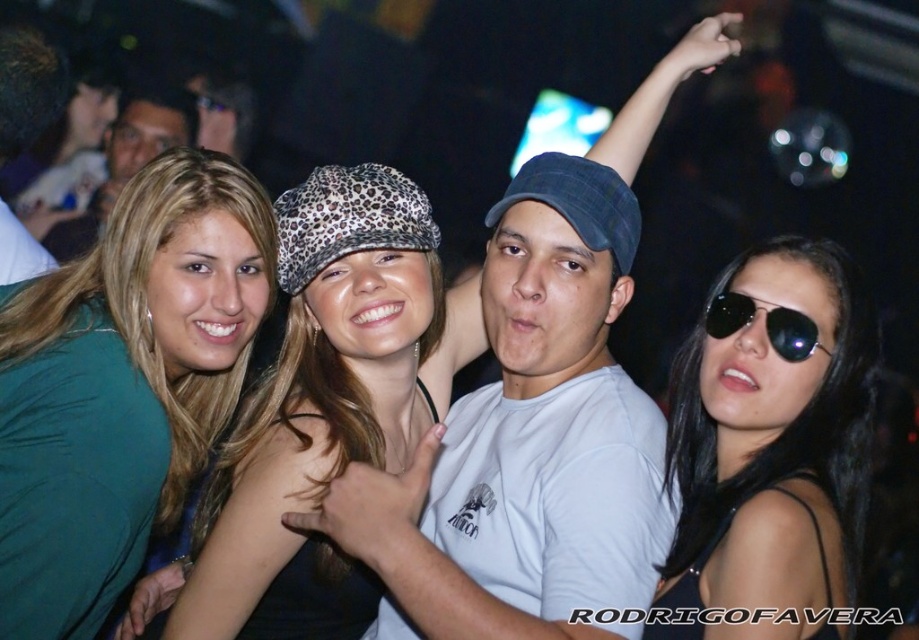
Question: Is leopard print hat at center above black aviator sunglasses at right?

Choices:
 (A) yes
 (B) no

Answer: (B)

Question: Which point is closer to the camera?

Choices:
 (A) sunglasses at upper right
 (B) matte black glasses at upper left

Answer: (A)

Question: Can you confirm if sunglasses at upper right is bigger than matte black glasses at upper left?

Choices:
 (A) yes
 (B) no

Answer: (B)

Question: Considering the real-world distances, which object is farthest from the leopard print hat at center?

Choices:
 (A) green fabric shirt at upper left
 (B) matte black tank top at center
 (C) sunglasses at upper right
 (D) black aviator sunglasses at right

Answer: (D)

Question: Can you confirm if sunglasses at upper right is bigger than matte black tank top at center?

Choices:
 (A) yes
 (B) no

Answer: (B)

Question: Which of these objects is positioned closest to the matte black glasses at upper left?

Choices:
 (A) matte green shirt at upper left
 (B) sunglasses at upper right
 (C) leopard print hat at center
 (D) black aviator sunglasses at right

Answer: (A)